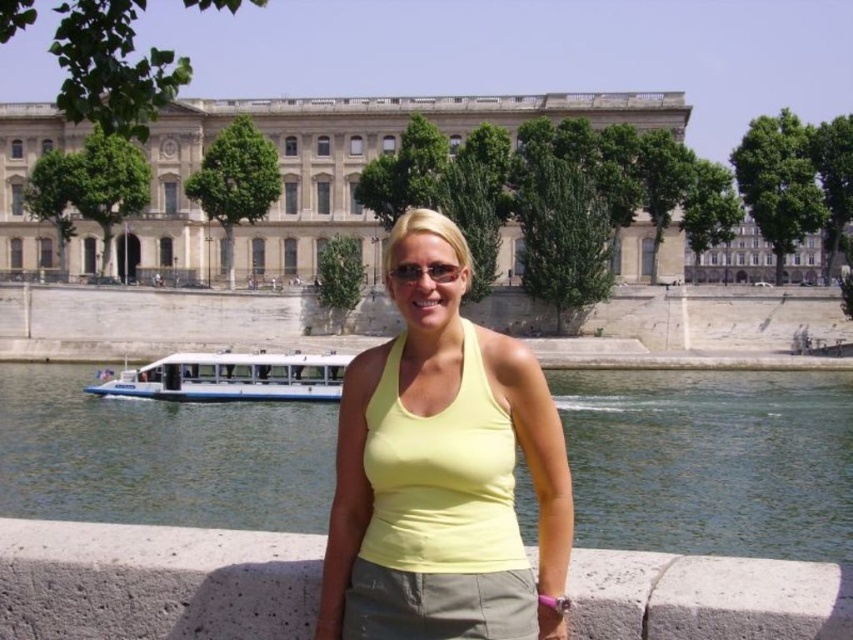
Which is more to the left, beige stone building at center or white matte boat at lower left?

From the viewer's perspective, white matte boat at lower left appears more on the left side.

Can you confirm if beige stone building at center is thinner than white matte boat at lower left?

In fact, beige stone building at center might be wider than white matte boat at lower left.

What do you see at coordinates (326, 170) in the screenshot?
I see `beige stone building at center` at bounding box center [326, 170].

This screenshot has width=853, height=640. I want to click on beige stone building at center, so tap(326, 170).

Who is lower down, green water at center or matte black sunglasses at center?

green water at center is below.

Can you confirm if green water at center is positioned to the right of matte black sunglasses at center?

In fact, green water at center is to the left of matte black sunglasses at center.

Which is behind, point (805, 376) or point (438, 262)?

The point (805, 376) is behind.

This screenshot has width=853, height=640. Identify the location of green water at center. (x=711, y=460).

This screenshot has width=853, height=640. What do you see at coordinates (442, 452) in the screenshot?
I see `yellow matte tank top at center` at bounding box center [442, 452].

Is yellow matte tank top at center thinner than white matte boat at lower left?

Correct, yellow matte tank top at center's width is less than white matte boat at lower left's.

Which is behind, point (405, 502) or point (171, 378)?

Positioned behind is point (171, 378).

Find the location of a particular element. The image size is (853, 640). yellow matte tank top at center is located at coordinates (442, 452).